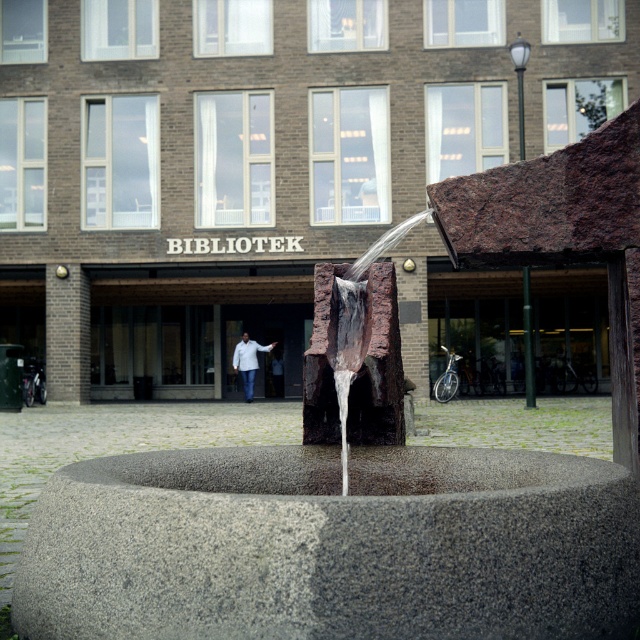
Is rustic stone fountain at center further to camera compared to white matte jacket at center?

No, rustic stone fountain at center is in front of white matte jacket at center.

Who is more distant from viewer, [380,237] or [237,369]?

Point [237,369]

Identify the location of rustic stone fountain at center. The height and width of the screenshot is (640, 640). (353, 326).

Which is in front, point (476, 538) or point (369, 250)?

Point (476, 538) is more forward.

The height and width of the screenshot is (640, 640). What do you see at coordinates (332, 545) in the screenshot?
I see `gray granite water at center` at bounding box center [332, 545].

At what (x,y) coordinates should I click in order to perform the action: click on gray granite water at center. Please return your answer as a coordinate pair (x, y). This screenshot has height=640, width=640. Looking at the image, I should click on (332, 545).

Is granite water feature at center above gray granite water at center?

Yes, granite water feature at center is above gray granite water at center.

Can you confirm if granite water feature at center is smaller than gray granite water at center?

No, granite water feature at center is not smaller than gray granite water at center.

Identify the location of granite water feature at center. This screenshot has height=640, width=640. (332, 545).

Identify the location of granite water feature at center. Image resolution: width=640 pixels, height=640 pixels. click(332, 545).